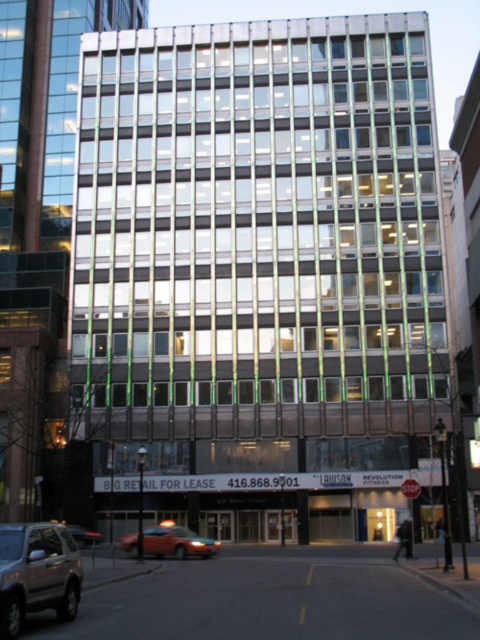
Does silver metallic suv at lower left appear on the right side of metallic silver taxi at lower left?

Correct, you'll find silver metallic suv at lower left to the right of metallic silver taxi at lower left.

Is silver metallic suv at lower left bigger than metallic silver taxi at lower left?

No.

Between point (71, 593) and point (96, 536), which one is positioned behind?

The point (96, 536) is more distant.

The height and width of the screenshot is (640, 480). Find the location of `silver metallic suv at lower left`. silver metallic suv at lower left is located at coordinates (36, 573).

Can you confirm if orange matte taxi at lower left is taller than metallic silver taxi at lower left?

Indeed, orange matte taxi at lower left has a greater height compared to metallic silver taxi at lower left.

Image resolution: width=480 pixels, height=640 pixels. Find the location of `orange matte taxi at lower left`. orange matte taxi at lower left is located at coordinates (168, 541).

This screenshot has height=640, width=480. What are the coordinates of `orange matte taxi at lower left` in the screenshot? It's located at (168, 541).

Can you confirm if silver metallic suv at lower left is smaller than orange matte taxi at lower left?

Correct, silver metallic suv at lower left occupies less space than orange matte taxi at lower left.

Is point (62, 524) positioned behind point (197, 538)?

Yes, it is.

Is point (35, 545) positioned after point (193, 547)?

No, it is not.

Where is `silver metallic suv at lower left`? The height and width of the screenshot is (640, 480). silver metallic suv at lower left is located at coordinates (36, 573).